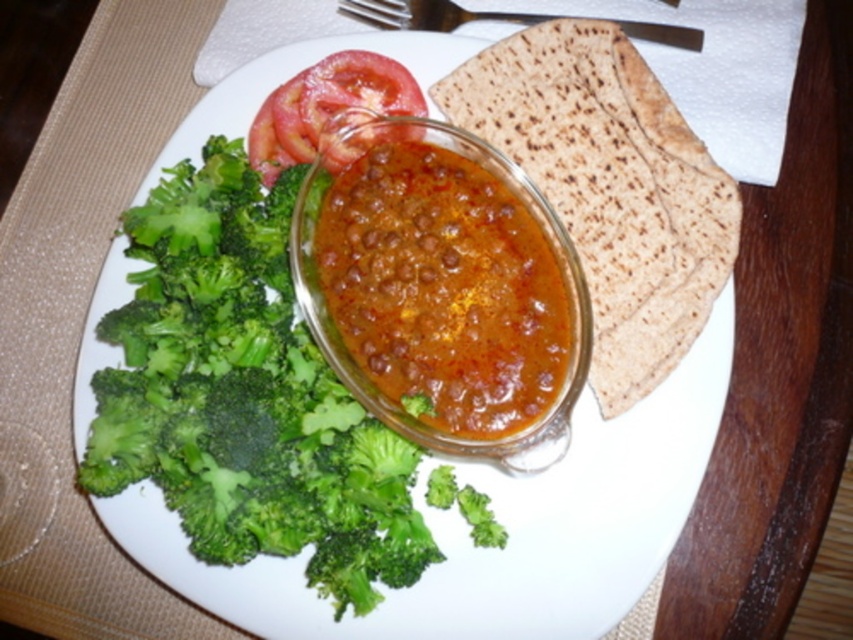
Question: Is the position of brown/crumbly tortilla at center-right less distant than that of brown glossy lentil curry at center?

Choices:
 (A) yes
 (B) no

Answer: (B)

Question: Which point is farther from the camera taking this photo?

Choices:
 (A) (634, 20)
 (B) (312, 109)

Answer: (A)

Question: Considering the relative positions of brown/crumbly tortilla at center-right and brown glossy lentil curry at center in the image provided, where is brown/crumbly tortilla at center-right located with respect to brown glossy lentil curry at center?

Choices:
 (A) left
 (B) right

Answer: (B)

Question: Estimate the real-world distances between objects in this image. Which object is closer to the brushed metal fork at upper center?

Choices:
 (A) brown glossy lentil curry at center
 (B) brown/crumbly tortilla at center-right
 (C) red smooth tomato at upper center

Answer: (C)

Question: Which point is farther to the camera?

Choices:
 (A) brown/crumbly tortilla at center-right
 (B) red smooth tomato at upper center
 (C) brushed metal fork at upper center
 (D) brown glossy lentil curry at center

Answer: (C)

Question: Where is red smooth tomato at upper center located in relation to brushed metal fork at upper center in the image?

Choices:
 (A) left
 (B) right

Answer: (A)